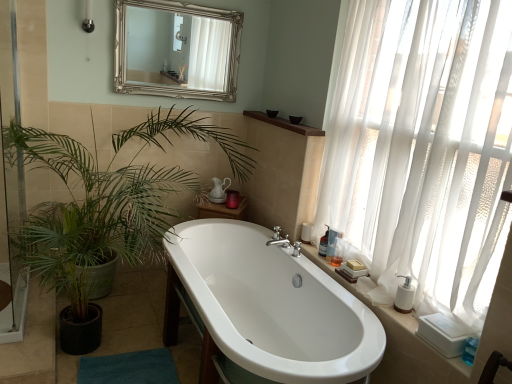
Locate an element on the screen. vacant space situated above silver/gilded mirror at upper center (from a real-world perspective) is located at coordinates (191, 6).